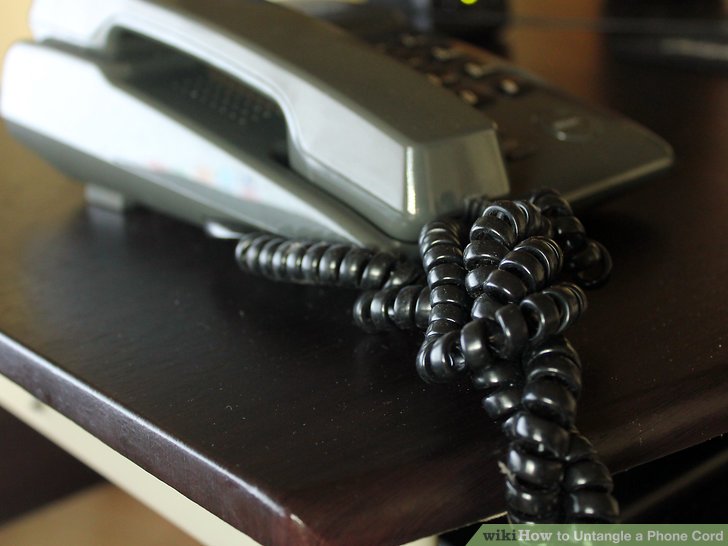
Locate an element on the screen. The height and width of the screenshot is (546, 728). keypad is located at coordinates (381, 48), (411, 48), (440, 47), (419, 55), (432, 74), (485, 68), (507, 78), (480, 94).